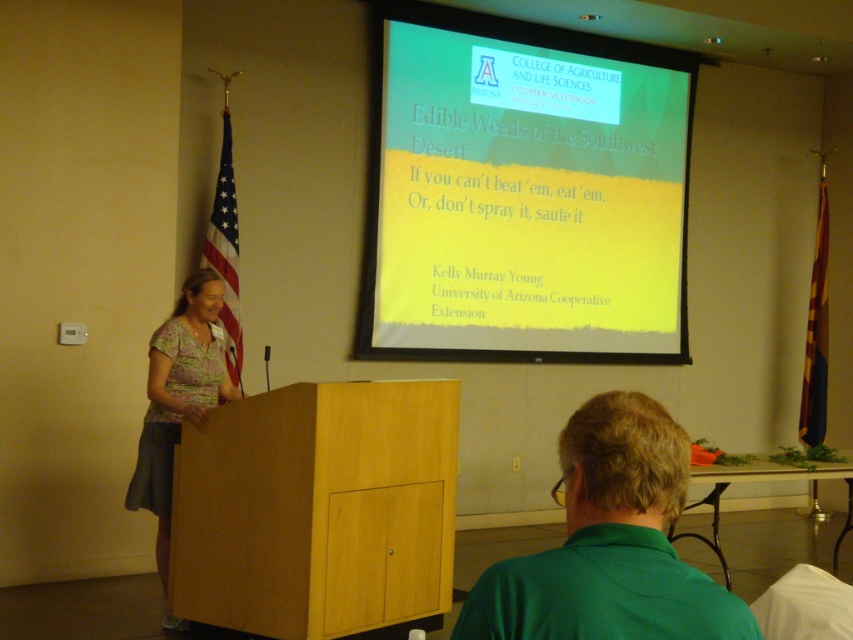
You are a guest speaker at an environmental conference and need to adjust your slide on the yellow matte projection screen at upper center. However, you notice the green fabric shirt at lower right is blocking your view. Based on the scene, can you walk around the shirt to access the screen?

Answer: The yellow matte projection screen at upper center is further to the viewer than the green fabric shirt at lower right, meaning the screen is closer to you. Since the shirt is behind the screen, you cannot walk around it to access the screen as the shirt is not in front.

You are an event planner setting up a presentation. You need to place a 2m wide banner between the yellow matte projection screen at upper center and the green fabric shirt at lower right. Can the banner fit horizontally between them?

The yellow matte projection screen at upper center is wider than the green fabric shirt at lower right. Since the banner is 2m wide, it may not fit if the space between them is narrower than 2m. However, the description only states the screen is wider, not the exact distance between them. Without knowing the actual spacing, we cannot confirm if the banner will fit.

You are an event planner organizing a workshop and need to arrange seating for attendees. You see a green fabric shirt at lower right and a floral fabric blouse at left in the image. Which attendee should you seat closer to the projection screen on the right side of the podium?

The attendee wearing the green fabric shirt at lower right should be seated closer to the projection screen on the right side of the podium since the green fabric shirt at lower right is already positioned to the right of the floral fabric blouse at left.